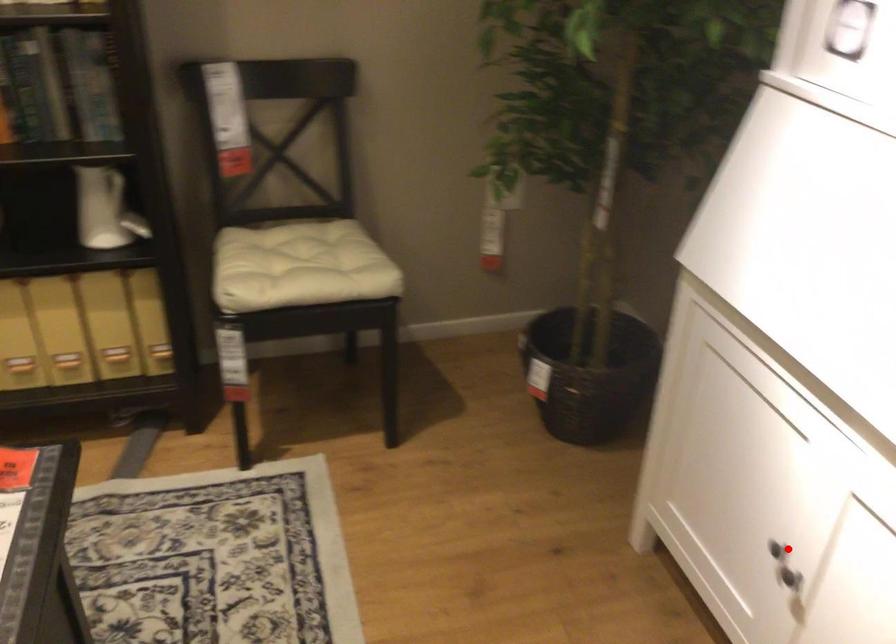
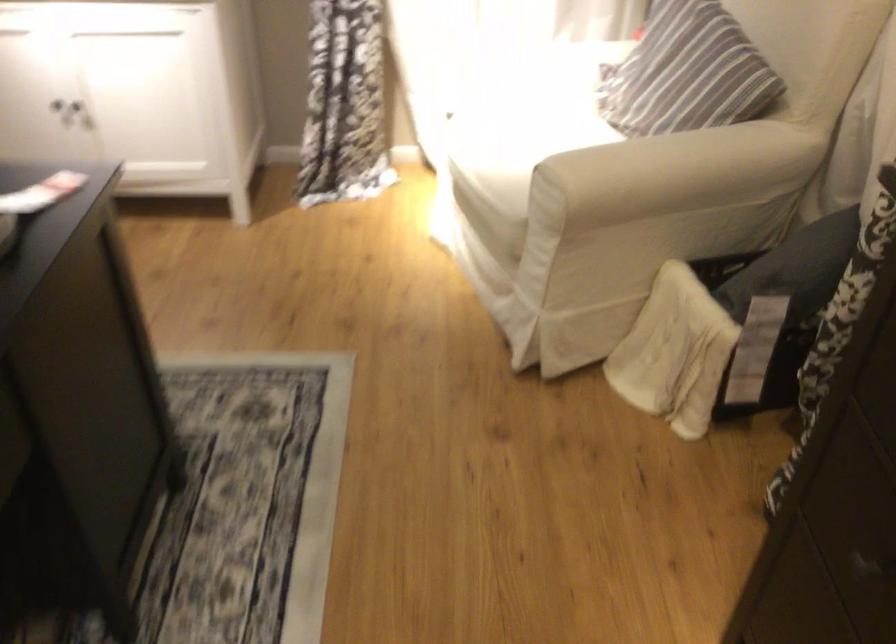
The point at the highlighted location is marked in the first image. Where is the corresponding point in the second image?

(67, 108)